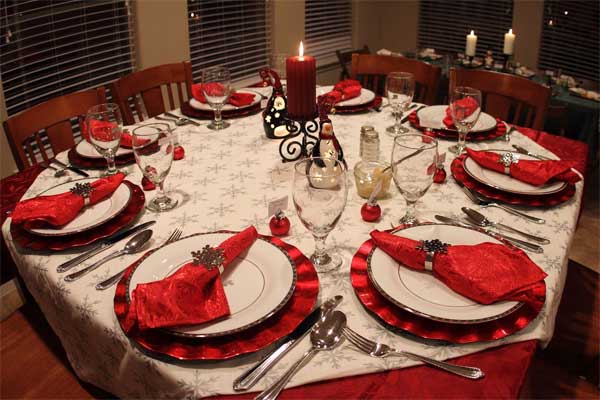
Where is `drinking glasses on front most table`? drinking glasses on front most table is located at coordinates (212, 82), (281, 59), (155, 141), (97, 133), (331, 202), (415, 168), (458, 113), (396, 95).